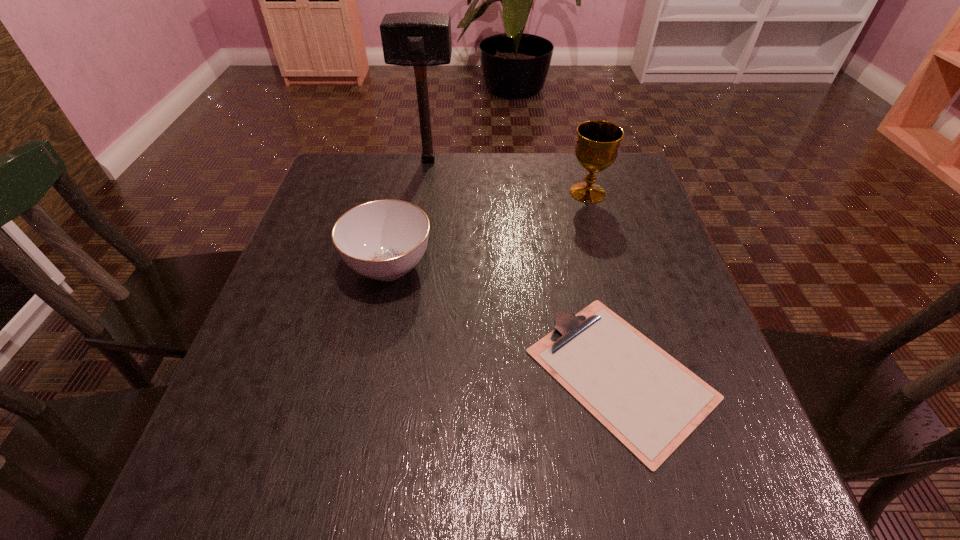
The width and height of the screenshot is (960, 540). I want to click on blank space at the far edge, so click(x=445, y=190).

Where is `vacant area at the near edge of the desktop`? vacant area at the near edge of the desktop is located at coordinates (657, 483).

At what (x,y) coordinates should I click in order to perform the action: click on vacant space at the left edge of the desktop. Please return your answer as a coordinate pair (x, y). This screenshot has height=540, width=960. Looking at the image, I should click on (307, 360).

Locate an element on the screen. The height and width of the screenshot is (540, 960). free space at the right edge of the desktop is located at coordinates (654, 243).

This screenshot has width=960, height=540. Identify the location of free space between the third shortest object and the second nearest object. (489, 230).

The height and width of the screenshot is (540, 960). Identify the location of empty location between the shortest object and the chalice. (604, 283).

The width and height of the screenshot is (960, 540). Find the location of `free spot between the mallet and the chalice`. free spot between the mallet and the chalice is located at coordinates (508, 177).

The image size is (960, 540). I want to click on unoccupied position between the second shortest object and the second farthest object, so click(489, 230).

Locate an element on the screen. This screenshot has height=540, width=960. unoccupied position between the nearest object and the mallet is located at coordinates (524, 267).

Find the location of a particular element. The image size is (960, 540). vacant point located between the second tallest object and the chinaware is located at coordinates (489, 230).